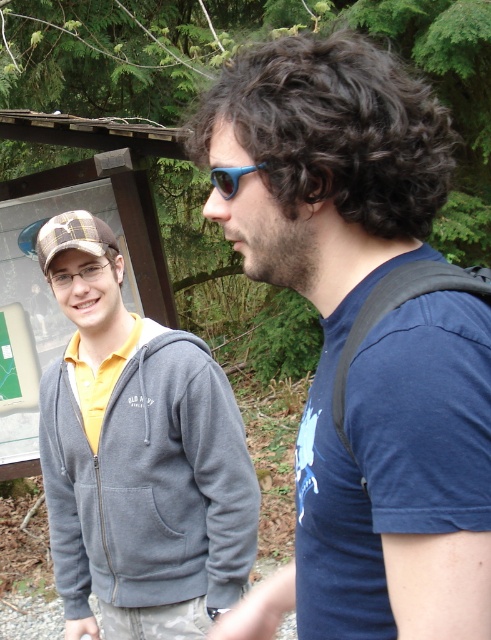
You are a photographer trying to capture a portrait of the matte gray hoodie at left. You need to focus your camera at a specific coordinate to get the best shot. What are the coordinates where you should focus your camera?

The coordinates for focusing the camera should be at point (x=137, y=456), as that is where the matte gray hoodie at left is positioned.